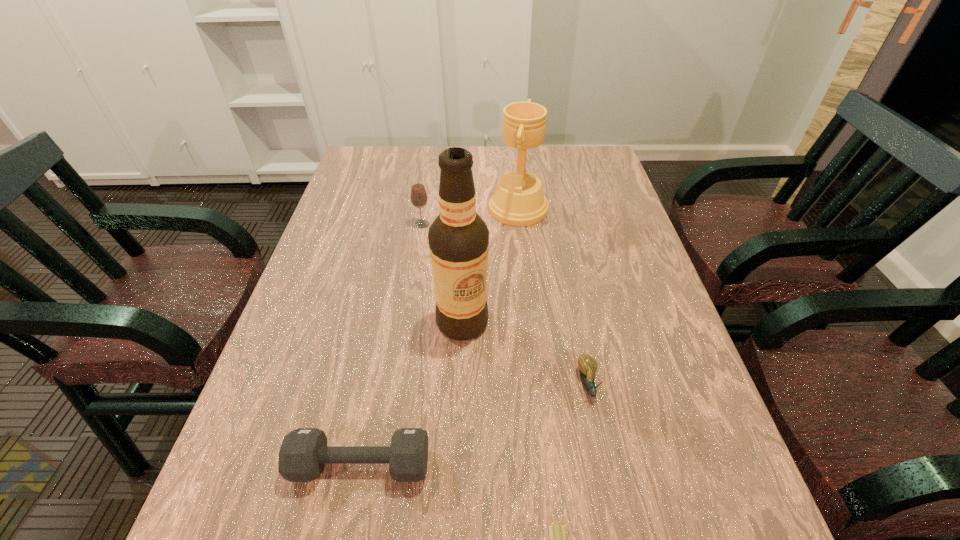
The height and width of the screenshot is (540, 960). I want to click on free location located on the right of the fourth shortest object, so click(479, 224).

Locate an element on the screen. blank space located 0.150m on the right of the dumbbell is located at coordinates (515, 464).

The image size is (960, 540). Find the location of `vacant space located on the front-facing side of the right escargot`. vacant space located on the front-facing side of the right escargot is located at coordinates (598, 436).

The height and width of the screenshot is (540, 960). I want to click on object that is at the left edge, so click(304, 452).

In the image, there is a desktop. Where is `vacant space at the far edge`? vacant space at the far edge is located at coordinates (431, 183).

Identify the location of blank space at the left edge of the desktop. (335, 305).

In the image, there is a desktop. Where is `blank space at the right edge`? The image size is (960, 540). blank space at the right edge is located at coordinates (586, 238).

The image size is (960, 540). Identify the location of vacant space at the far left corner of the desktop. coord(389,159).

Image resolution: width=960 pixels, height=540 pixels. I want to click on free space between the glass drink container and the third shortest object, so 392,345.

Identify the location of empty location between the farther escargot and the fifth shortest object. The width and height of the screenshot is (960, 540). click(x=553, y=296).